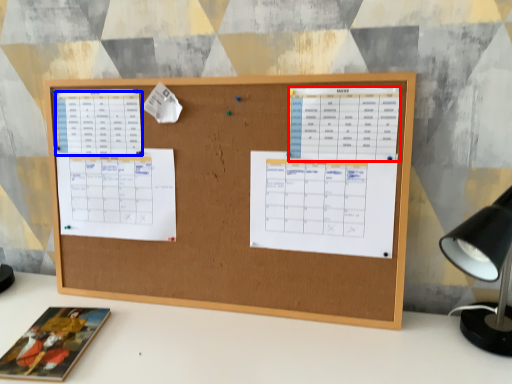
Question: Which object appears closest to the camera in this image, list (highlighted by a red box) or list (highlighted by a blue box)?

Choices:
 (A) list
 (B) list

Answer: (A)